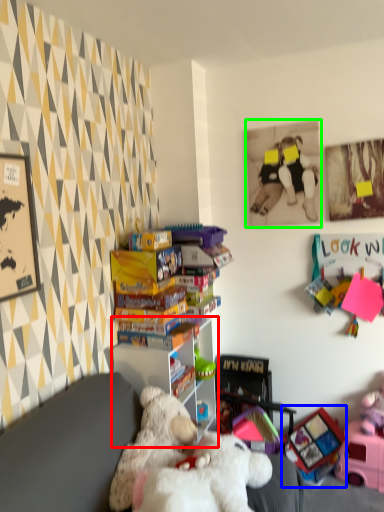
Question: Based on their relative distances, which object is nearer to shelf (highlighted by a red box)? Choose from toy (highlighted by a blue box) and picture frame (highlighted by a green box).

Choices:
 (A) toy
 (B) picture frame

Answer: (A)